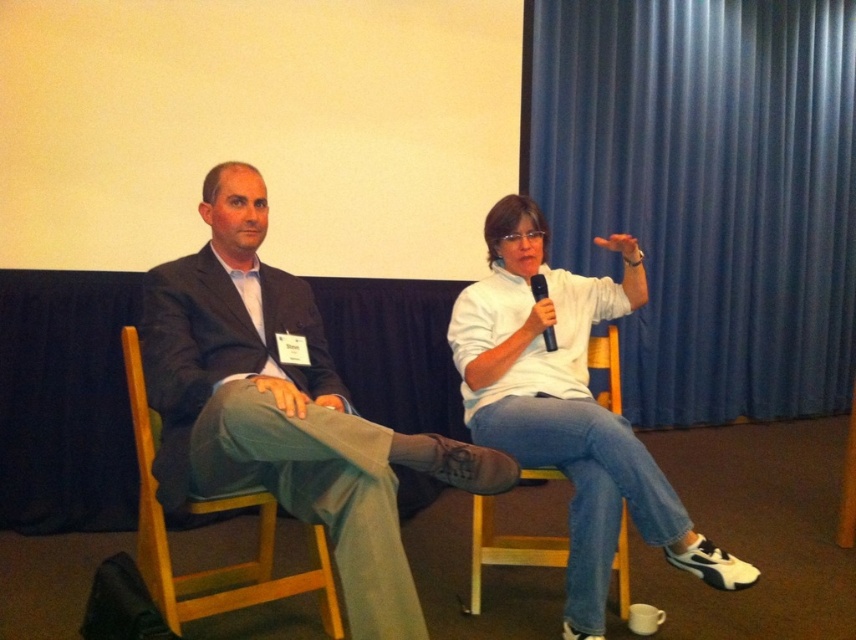
Question: Which point appears closest to the camera in this image?

Choices:
 (A) (504, 413)
 (B) (324, 548)
 (C) (533, 289)

Answer: (B)

Question: Which object is the closest to the black matte microphone at upper right?

Choices:
 (A) blue fabric curtain at upper right
 (B) wooden chair at right
 (C) white matte shirt at center
 (D) wooden chair at left

Answer: (C)

Question: Considering the real-world distances, which object is closest to the black matte microphone at upper right?

Choices:
 (A) blue fabric curtain at upper right
 (B) wooden chair at left
 (C) white matte shirt at center
 (D) matte black suit at left

Answer: (C)

Question: Can you confirm if blue fabric curtain at upper right is thinner than black matte microphone at upper right?

Choices:
 (A) yes
 (B) no

Answer: (B)

Question: From the image, what is the correct spatial relationship of blue fabric curtain at upper right in relation to matte black suit at left?

Choices:
 (A) above
 (B) below

Answer: (A)

Question: Can you confirm if blue fabric curtain at upper right is wider than white matte shirt at center?

Choices:
 (A) no
 (B) yes

Answer: (B)